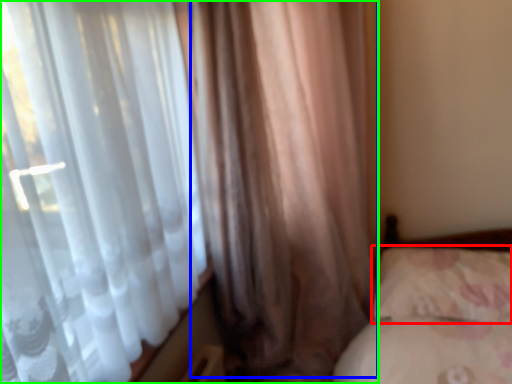
Question: Which is farther away from pillow (highlighted by a red box)? curtain (highlighted by a blue box) or curtain (highlighted by a green box)?

Choices:
 (A) curtain
 (B) curtain

Answer: (B)